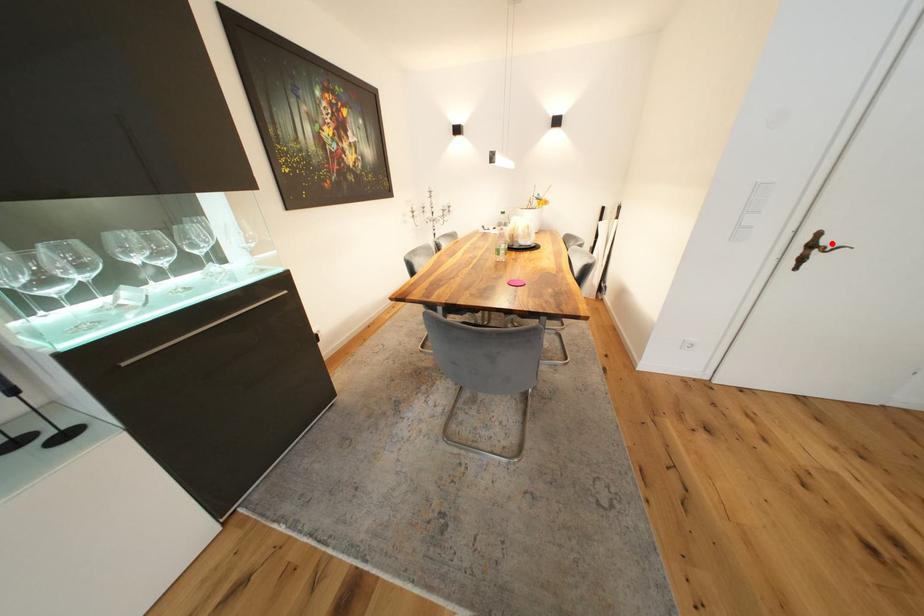
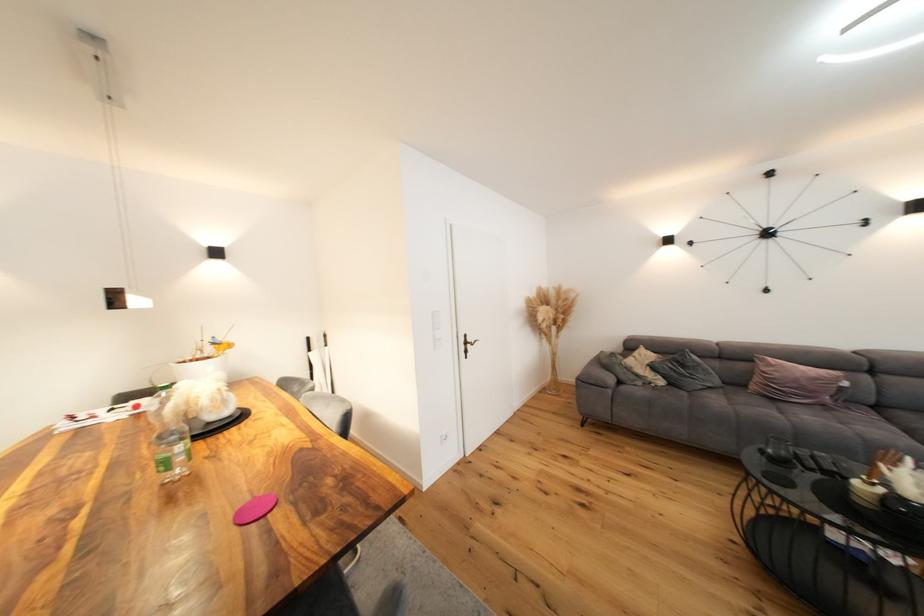
Find the pixel in the second image that matches the highlighted location in the first image.

(476, 341)